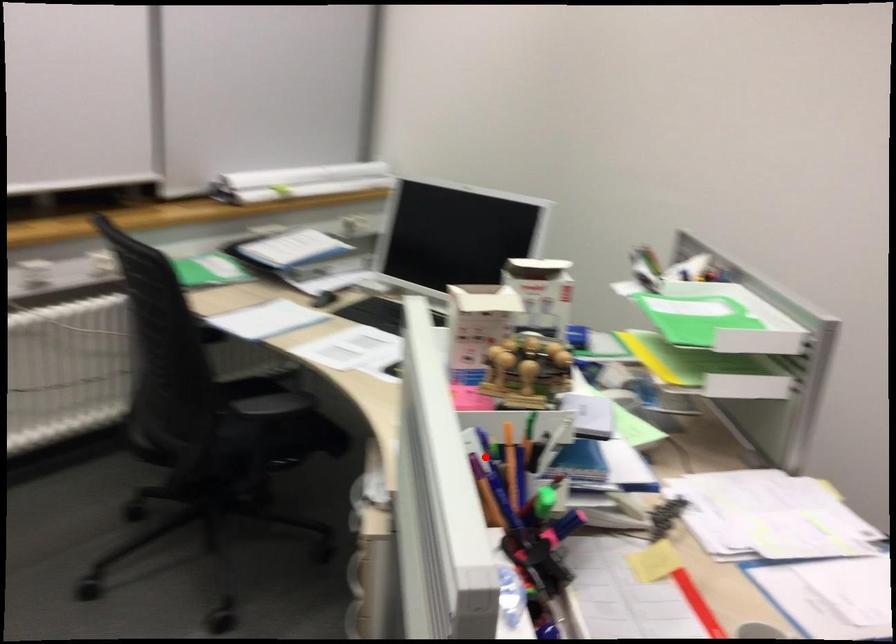
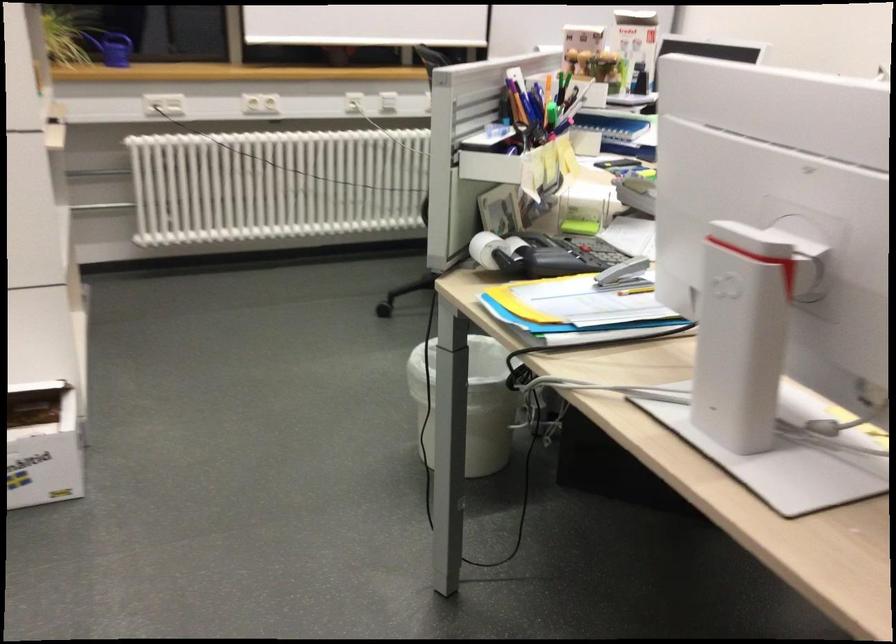
Question: I am providing you with two images of the same scene from different viewpoints. Given a red point in image1, look at the same physical point in image2. Is it:

Choices:
 (A) Closer to the viewpoint
 (B) Farther from the viewpoint

Answer: (B)